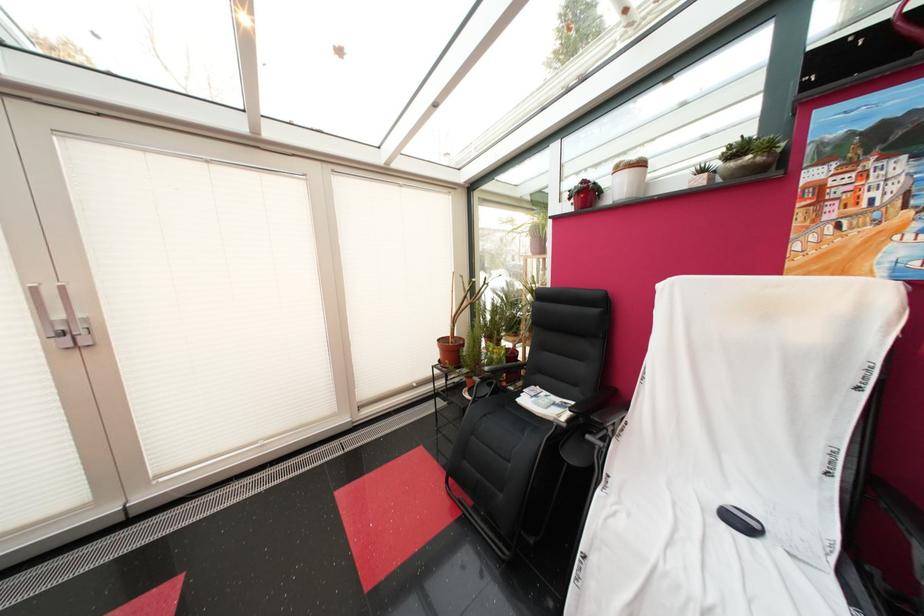
Locate an element on the screen. This screenshot has height=616, width=924. red flower pot is located at coordinates (450, 350).